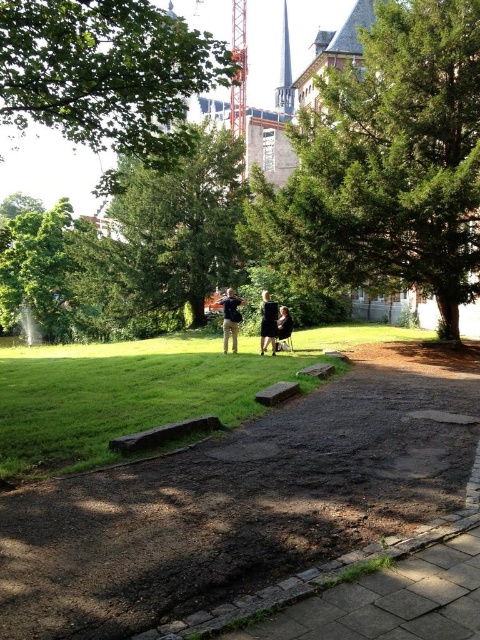
Question: Which object is closer to the camera taking this photo?

Choices:
 (A) green leafy tree at center
 (B) brown dirt path at center
 (C) green textured tree at center
 (D) green leafy tree at upper center

Answer: (B)

Question: Does green textured tree at center lie behind black fabric shirt at center?

Choices:
 (A) yes
 (B) no

Answer: (B)

Question: Which point is farther from the camera taking this photo?

Choices:
 (A) (468, 392)
 (B) (182, 173)

Answer: (B)

Question: Can you confirm if green leafy tree at center is positioned to the right of orange metallic crane at upper center?

Choices:
 (A) yes
 (B) no

Answer: (A)

Question: Can you confirm if brown dirt path at center is wider than green leafy tree at upper center?

Choices:
 (A) no
 (B) yes

Answer: (A)

Question: Which point is farther from the camera taking this photo?

Choices:
 (A) (276, 330)
 (B) (240, 317)

Answer: (A)